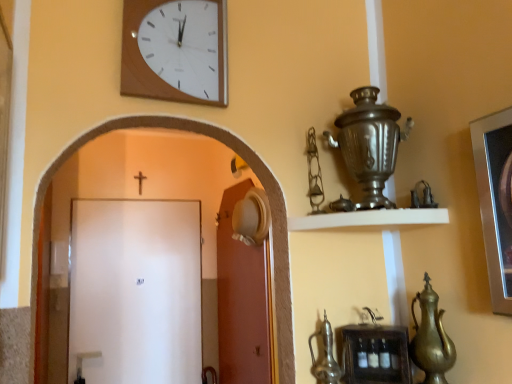
Question: Is gold metallic teapot at lower right, marked as the first tea pot in a right-to-left arrangement, wider or thinner than white matte door at center, acting as the 1th door starting from the right?

Choices:
 (A) wide
 (B) thin

Answer: (A)

Question: From a real-world perspective, is gold metallic teapot at lower right, which appears as the second tea pot when viewed from the left, above or below white matte door at center, which is the second door from left to right?

Choices:
 (A) above
 (B) below

Answer: (B)

Question: Which object is positioned farthest from the white matte door at center, acting as the 1th door starting from the right?

Choices:
 (A) gold metallic teapot at lower right, marked as the first tea pot in a right-to-left arrangement
 (B) white matte door at center, which ranks as the second door in right-to-left order
 (C) metallic silver teapot at lower center, placed as the second tea pot when sorted from right to left
 (D) woodenclock at upper center
 (E) wooden shelf at lower center, which is counted as the 1th shelf, starting from the bottom

Answer: (D)

Question: Estimate the real-world distances between objects in this image. Which object is farther from the shiny silver samovar at upper right?

Choices:
 (A) white matte shelf at upper center, the first shelf positioned from the top
 (B) gold metallic teapot at lower right, which appears as the second tea pot when viewed from the left
 (C) white matte door at center, the 1th door positioned from the left
 (D) metallic silver teapot at lower center, placed as the second tea pot when sorted from right to left
 (E) black wooden crucifix at upper center

Answer: (E)